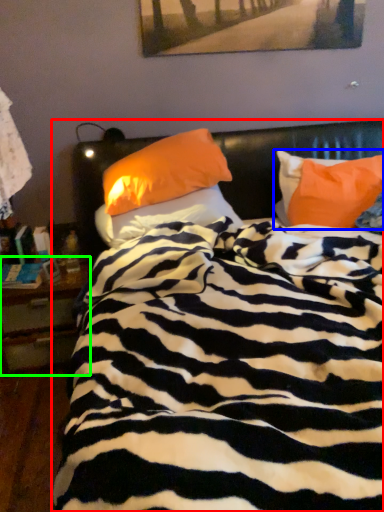
Question: Based on their relative distances, which object is nearer to bed (highlighted by a red box)? Choose from pillow (highlighted by a blue box) and nightstand (highlighted by a green box).

Choices:
 (A) pillow
 (B) nightstand

Answer: (A)